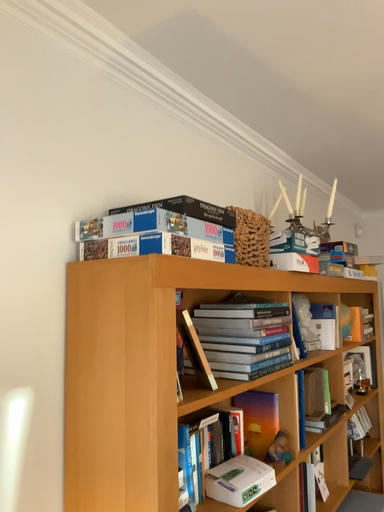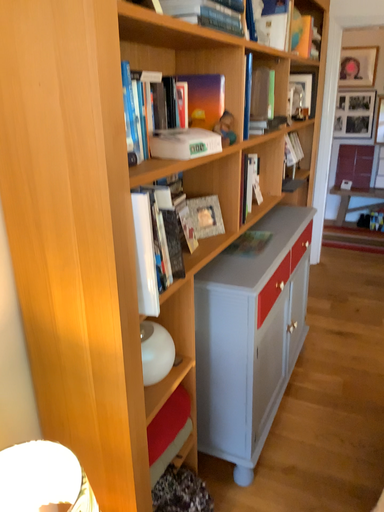
Question: Which way did the camera rotate in the video?

Choices:
 (A) rotated left
 (B) rotated right

Answer: (B)